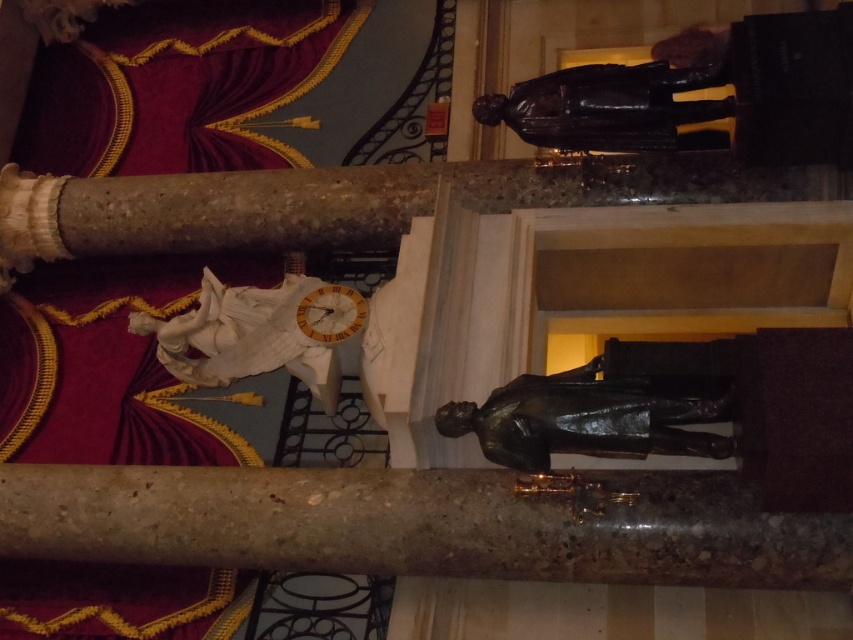
You are an art curator planning to move the bronze statue at center and the bronze statue at upper right to a new exhibition space. The new space has a narrow corridor that can only accommodate statues with a width of 1 meter or less. Based on the current scene, which statue would you recommend moving first to ensure it fits through the corridor?

The bronze statue at center is thinner than the bronze statue at upper right. Since the corridor can only accommodate statues with a width of 1 meter or less, the bronze statue at center should be moved first as it is more likely to fit through the narrow corridor.

Looking at this image, you are standing in the historical building and want to take a photo of the bronze statue at center. To ensure the statue is centered in your photo, where should you position yourself relative to the marble columns on either side?

To center the bronze statue at center in your photo, position yourself equidistant between the two marble columns on either side, as the statue is located at coordinates point (595,417) which is centrally positioned between the columns.

You are an art conservator assessing the placement of two statues in a historical building. The scene shows a bronze statue at center and a white marble statue at center. According to the spatial arrangement, which statue is positioned lower in the image?

The bronze statue at center is positioned lower than the white marble statue at center, as it is described to be below it.